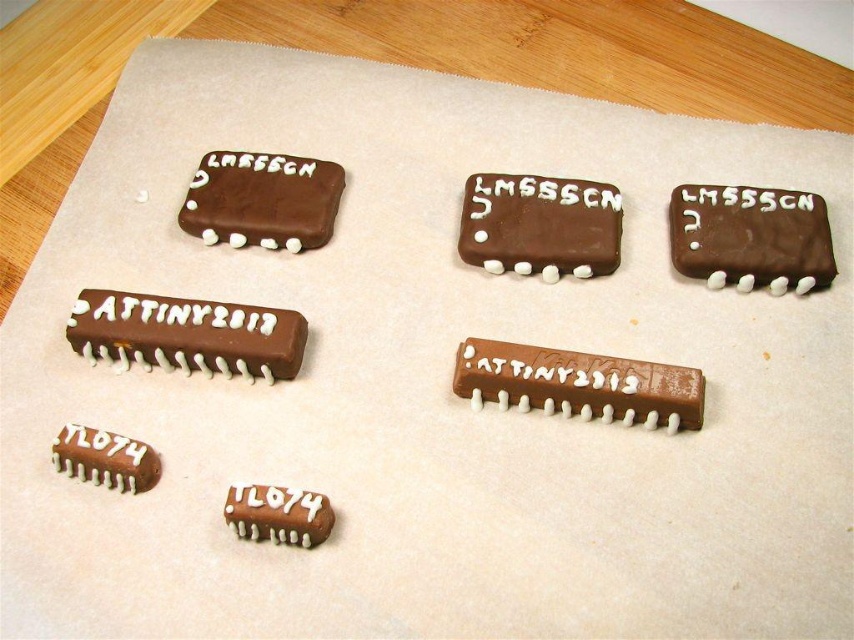
Question: Is chocolatesmoothintegrated circuit at upper right wider than chocolatesmoothintegrated circuit at center?

Choices:
 (A) no
 (B) yes

Answer: (A)

Question: Which of these objects is positioned farthest from the matte brown chip at bottom left?

Choices:
 (A) chocolatesmoothintegrated circuit at center
 (B) chocolatesmoothchip at upper left
 (C) chocolatesmoothattiny2312 at center
 (D) chocolatesmoothintegrated circuit at upper right

Answer: (D)

Question: Considering the real-world distances, which object is closest to the chocolatesmoothintegrated circuit at center?

Choices:
 (A) matte chocolate chip at lower center
 (B) chocolatesmoothintegrated circuit at upper right
 (C) matte brown chip at bottom left

Answer: (B)

Question: Among these points, which one is nearest to the camera?

Choices:
 (A) (278, 216)
 (B) (200, 352)
 (C) (489, 234)

Answer: (B)

Question: Is chocolatesmoothattiny2312 at center to the right of matte chocolate chip at lower center from the viewer's perspective?

Choices:
 (A) yes
 (B) no

Answer: (A)

Question: Can you confirm if chocolatesmoothintegrated circuit at upper right is positioned to the left of chocolatesmoothchip at upper left?

Choices:
 (A) no
 (B) yes

Answer: (A)